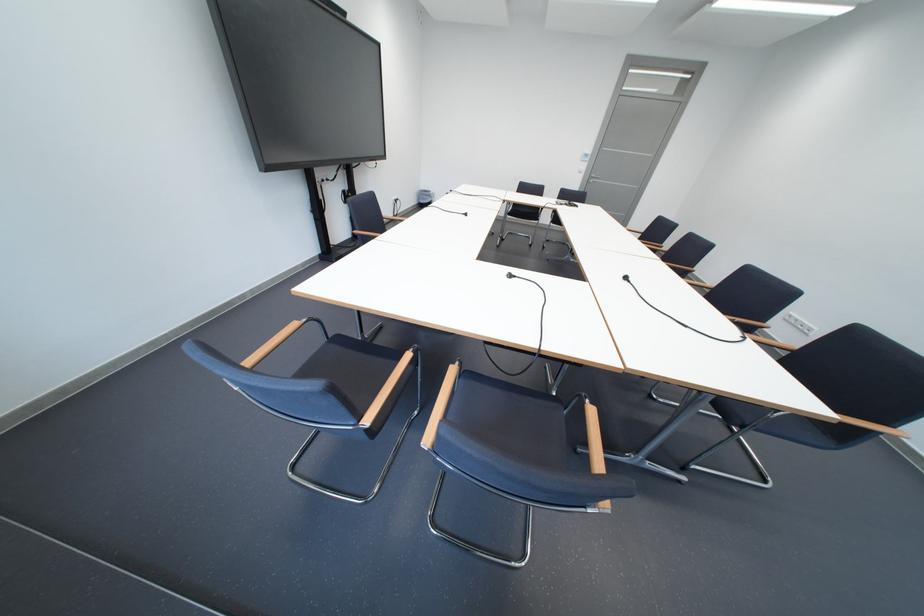
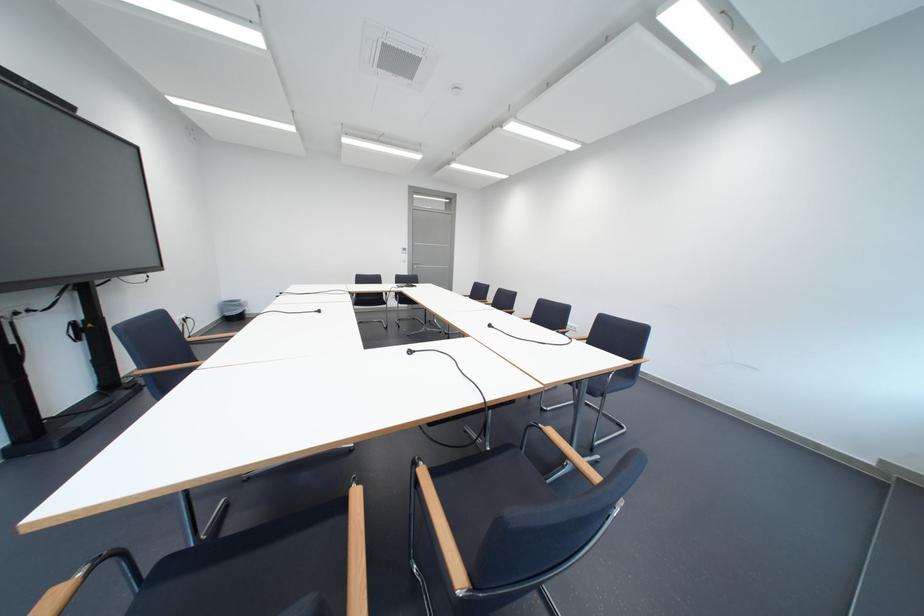
Find the pixel in the second image that matches (x=597, y=405) in the first image.

(553, 431)